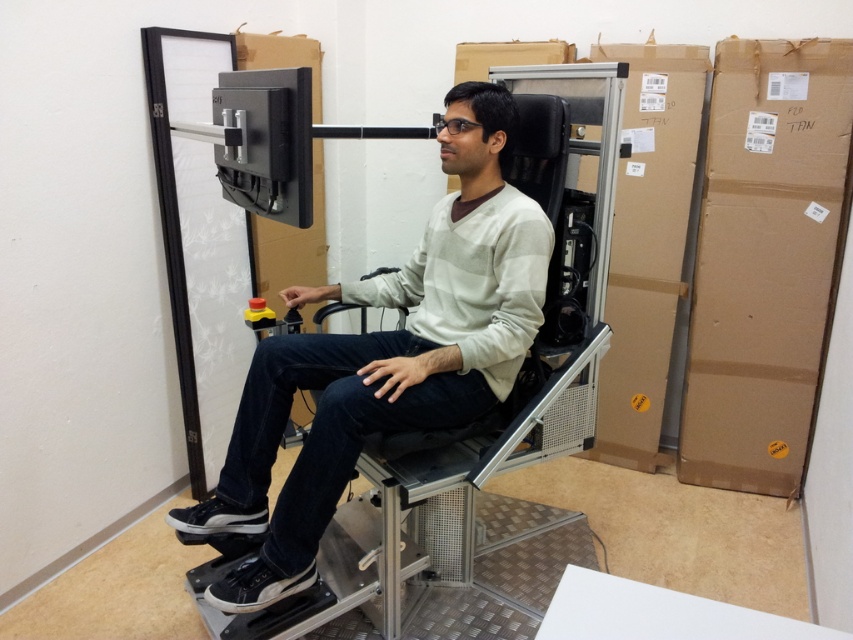
Consider the image. Between matte gray chair at center and brown cardboard box at right, which one appears on the right side from the viewer's perspective?

From the viewer's perspective, brown cardboard box at right appears more on the right side.

What do you see at coordinates (386, 356) in the screenshot?
I see `matte gray chair at center` at bounding box center [386, 356].

Who is more forward, (276, 413) or (799, 40)?

Positioned in front is point (276, 413).

The image size is (853, 640). I want to click on matte gray chair at center, so click(386, 356).